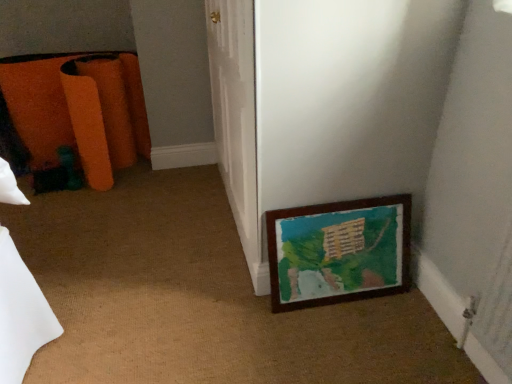
Locate an element on the screen. This screenshot has height=384, width=512. empty space that is to the right of wooden picture frame at lower right is located at coordinates (411, 312).